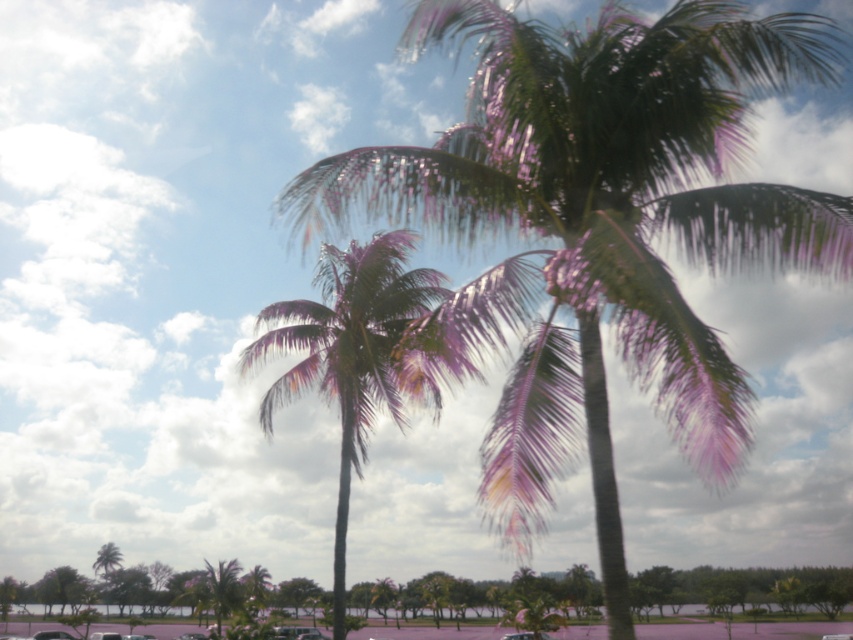
Who is shorter, green leafy coconut tree at center or green leafy palm tree at center?

green leafy palm tree at center

Locate an element on the screen. The height and width of the screenshot is (640, 853). green leafy coconut tree at center is located at coordinates (599, 224).

Is point (824, 67) closer to camera compared to point (355, 428)?

Yes, it is.

Where is `green leafy coconut tree at center`? green leafy coconut tree at center is located at coordinates (599, 224).